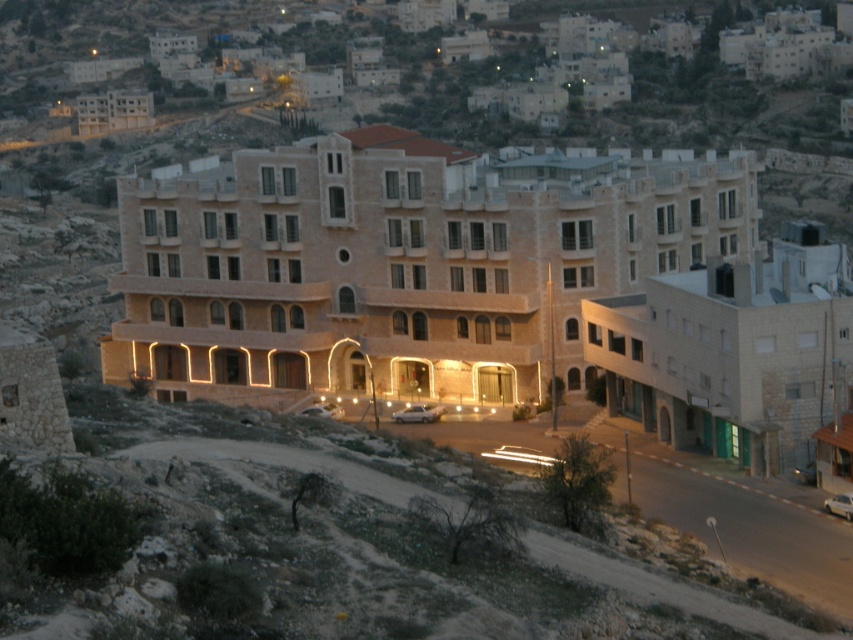
You are standing on the ground floor of the beige stone hotel at center and want to walk to the beige stone building at upper center. Which direction should you head towards?

You should head upwards because the beige stone building at upper center is further away from you than the beige stone hotel at center, so you need to move in the upward direction to reach it.

Consider the image. You are standing at the entrance of the beige stone hotel at center and want to go to the beige stone building at lower right. Which direction should you head to reach it?

The beige stone building at lower right is below the beige stone hotel at center, so you should head downward to reach it.